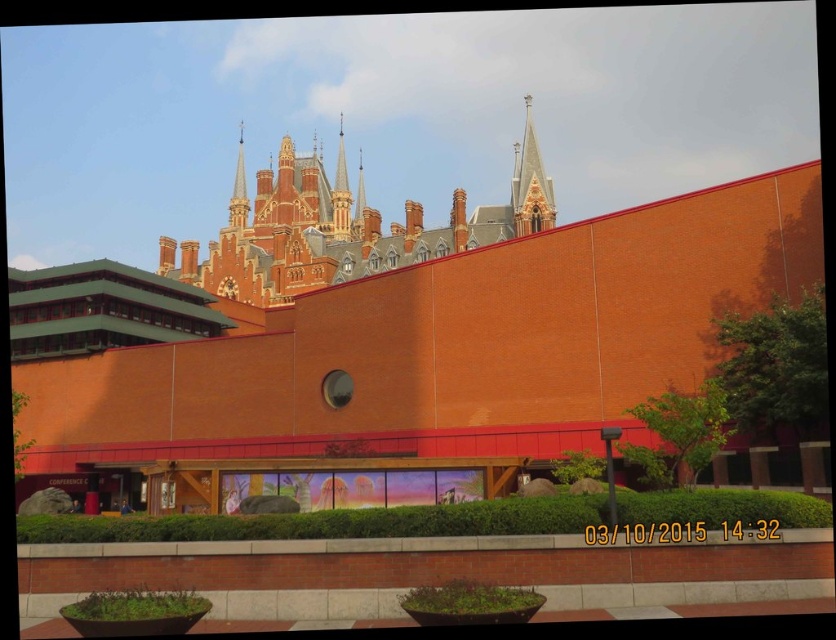
Question: Can you confirm if red brick spire at upper center is smaller than smooth brick spire at upper center?

Choices:
 (A) yes
 (B) no

Answer: (A)

Question: Is red brick spire at upper center positioned before smooth stone spire at upper center?

Choices:
 (A) no
 (B) yes

Answer: (B)

Question: Which point is closer to the camera taking this photo?

Choices:
 (A) (345, 212)
 (B) (248, 204)
 (C) (354, 218)
 (D) (449, 234)

Answer: (D)

Question: Which object is positioned closest to the red brick spire at upper center?

Choices:
 (A) brick church at upper center
 (B) smooth brick spire at upper center

Answer: (B)

Question: Which point is farther to the camera?

Choices:
 (A) smooth brick spire at upper center
 (B) red brick spire at upper center
 (C) brick church at upper center
 (D) smooth stone spire at upper center

Answer: (D)

Question: Is brick church at upper center behind red brick spire at upper center?

Choices:
 (A) yes
 (B) no

Answer: (B)